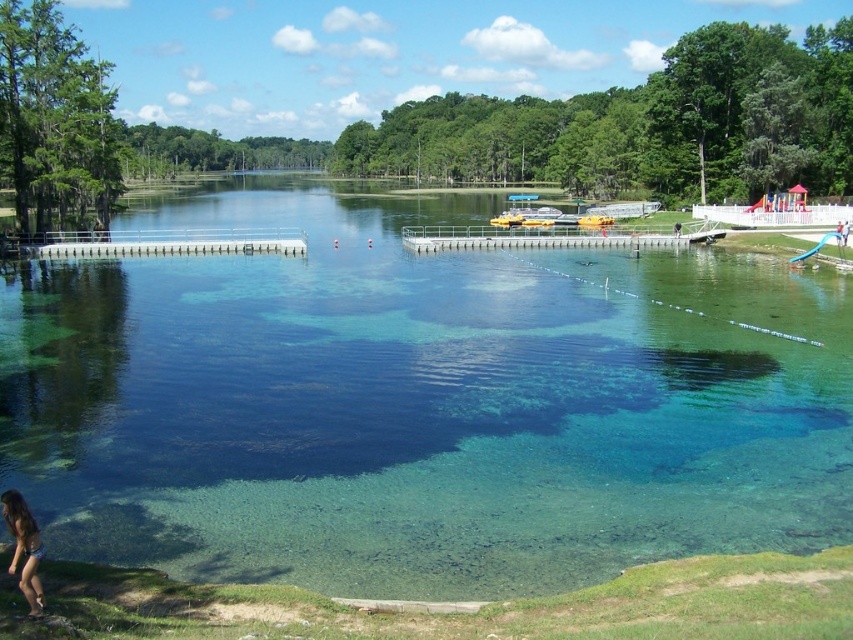
Is clear glass water at center thinner than white plastic dock at center?

No.

Is point (602, 468) behind point (164, 250)?

No, (602, 468) is in front of (164, 250).

Locate an element on the screen. The height and width of the screenshot is (640, 853). clear glass water at center is located at coordinates (421, 403).

At what (x,y) coordinates should I click in order to perform the action: click on clear glass water at center. Please return your answer as a coordinate pair (x, y). The width and height of the screenshot is (853, 640). Looking at the image, I should click on (421, 403).

Between white plastic dock at center and brown leather jacket at lower center, which one appears on the right side from the viewer's perspective?

brown leather jacket at lower center is more to the right.

Does white plastic dock at center have a greater height compared to brown leather jacket at lower center?

Correct, white plastic dock at center is much taller as brown leather jacket at lower center.

Between point (125, 250) and point (672, 227), which one is positioned in front?

Point (125, 250) is more forward.

The height and width of the screenshot is (640, 853). What are the coordinates of `white plastic dock at center` in the screenshot? It's located at (171, 244).

Is metallic gray dock at center smaller than brown leather jacket at lower center?

Incorrect, metallic gray dock at center is not smaller in size than brown leather jacket at lower center.

Does point (711, 236) lie behind point (677, 227)?

No, (711, 236) is in front of (677, 227).

The image size is (853, 640). What are the coordinates of `metallic gray dock at center` in the screenshot? It's located at (541, 237).

Identify the location of metallic gray dock at center. The width and height of the screenshot is (853, 640). (541, 237).